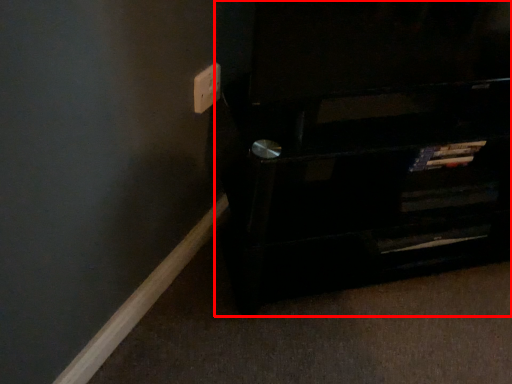
Question: Considering the relative positions of furniture (annotated by the red box) and electric outlet in the image provided, where is furniture (annotated by the red box) located with respect to the staircase?

Choices:
 (A) left
 (B) right

Answer: (B)